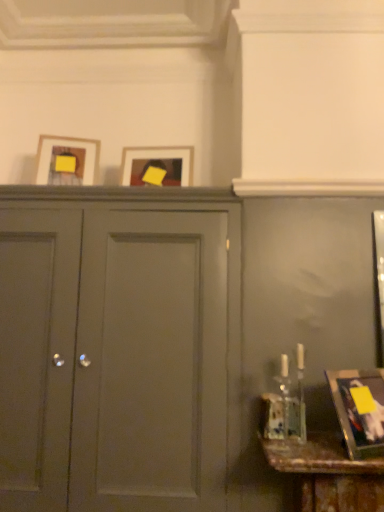
Question: Considering the relative positions of metallic gold picture frame at lower right, arranged as the 1th picture frame when viewed from the front, and matte wooden picture frame at upper left, which ranks as the third picture frame in bottom-to-top order, in the image provided, is metallic gold picture frame at lower right, arranged as the 1th picture frame when viewed from the front, to the left of matte wooden picture frame at upper left, which ranks as the third picture frame in bottom-to-top order, from the viewer's perspective?

Choices:
 (A) yes
 (B) no

Answer: (B)

Question: Is metallic gold picture frame at lower right, marked as the 3th picture frame in a back-to-front arrangement, aimed at matte wooden picture frame at upper left, the first picture frame in the left-to-right sequence?

Choices:
 (A) yes
 (B) no

Answer: (B)

Question: Is metallic gold picture frame at lower right, arranged as the 1th picture frame when viewed from the front, touching matte wooden picture frame at upper left, the second picture frame viewed from the front?

Choices:
 (A) yes
 (B) no

Answer: (B)

Question: Is metallic gold picture frame at lower right, arranged as the 1th picture frame when viewed from the front, facing away from matte wooden picture frame at upper left, the second picture frame viewed from the front?

Choices:
 (A) yes
 (B) no

Answer: (B)

Question: Can you confirm if metallic gold picture frame at lower right, placed as the 3th picture frame when sorted from left to right, is positioned to the right of matte wooden picture frame at upper left, the second picture frame viewed from the front?

Choices:
 (A) no
 (B) yes

Answer: (B)

Question: Is point (125, 177) closer or farther from the camera than point (84, 251)?

Choices:
 (A) farther
 (B) closer

Answer: (A)

Question: Is matte wooden picture frame at center, which is counted as the second picture frame, starting from the left, situated inside matte gray cabinet at center or outside?

Choices:
 (A) inside
 (B) outside

Answer: (B)

Question: Based on their positions, is matte wooden picture frame at center, the 2th picture frame viewed from the right, located to the left or right of matte gray cabinet at center?

Choices:
 (A) right
 (B) left

Answer: (A)

Question: Looking at their shapes, would you say matte wooden picture frame at center, marked as the third picture frame in a front-to-back arrangement, is wider or thinner than matte gray cabinet at center?

Choices:
 (A) thin
 (B) wide

Answer: (A)

Question: From a real-world perspective, is matte wooden picture frame at upper left, which is counted as the first picture frame, starting from the top, above or below matte wooden picture frame at center, which appears as the 2th picture frame when viewed from the top?

Choices:
 (A) above
 (B) below

Answer: (A)

Question: Considering the positions of matte wooden picture frame at upper left, which is counted as the first picture frame, starting from the top, and matte wooden picture frame at center, marked as the third picture frame in a front-to-back arrangement, in the image, is matte wooden picture frame at upper left, which is counted as the first picture frame, starting from the top, wider or thinner than matte wooden picture frame at center, marked as the third picture frame in a front-to-back arrangement,?

Choices:
 (A) wide
 (B) thin

Answer: (A)

Question: Is matte wooden picture frame at upper left, the first picture frame in the left-to-right sequence, in front of or behind matte wooden picture frame at center, marked as the third picture frame in a front-to-back arrangement, in the image?

Choices:
 (A) front
 (B) behind

Answer: (A)

Question: Is point (39, 180) closer or farther from the camera than point (152, 159)?

Choices:
 (A) closer
 (B) farther

Answer: (A)

Question: Considering the positions of point (347, 409) and point (64, 401), is point (347, 409) closer or farther from the camera than point (64, 401)?

Choices:
 (A) closer
 (B) farther

Answer: (A)

Question: In terms of width, does metallic gold picture frame at lower right, marked as the 3th picture frame in a back-to-front arrangement, look wider or thinner when compared to matte gray cabinet at center?

Choices:
 (A) wide
 (B) thin

Answer: (B)